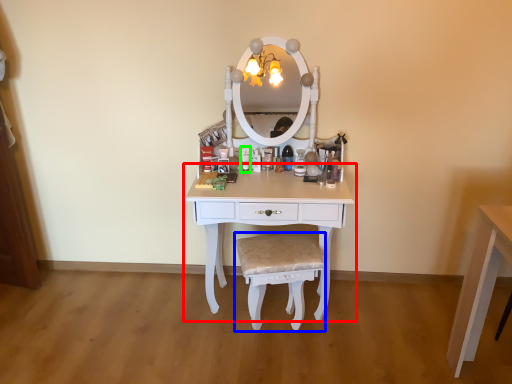
Question: Estimate the real-world distances between objects in this image. Which object is farther from table (highlighted by a red box), chair (highlighted by a blue box) or toiletry (highlighted by a green box)?

Choices:
 (A) chair
 (B) toiletry

Answer: (B)